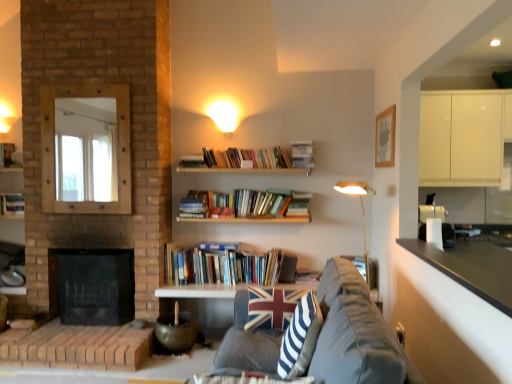
Question: Can you confirm if matte white lampshade at upper center is thinner than union jack fabric pillow at center?

Choices:
 (A) no
 (B) yes

Answer: (B)

Question: Is matte white lampshade at upper center positioned behind union jack fabric pillow at center?

Choices:
 (A) no
 (B) yes

Answer: (B)

Question: From the image's perspective, is matte white lampshade at upper center located above union jack fabric pillow at center?

Choices:
 (A) yes
 (B) no

Answer: (A)

Question: Is matte white lampshade at upper center placed right next to union jack fabric pillow at center?

Choices:
 (A) no
 (B) yes

Answer: (A)

Question: Is union jack fabric pillow at center completely or partially inside matte white lampshade at upper center?

Choices:
 (A) yes
 (B) no

Answer: (B)

Question: Choose the correct answer: Is white glossy cabinet at upper right inside hardcover books at center, which appears as the second book when viewed from the left, or outside it?

Choices:
 (A) outside
 (B) inside

Answer: (A)

Question: In the image, is white glossy cabinet at upper right on the left side or the right side of hardcover books at center, the 2th book when ordered from bottom to top?

Choices:
 (A) left
 (B) right

Answer: (B)

Question: Does point (453, 172) appear closer or farther from the camera than point (260, 274)?

Choices:
 (A) closer
 (B) farther

Answer: (A)

Question: In the image, is white glossy cabinet at upper right positioned in front of or behind hardcover books at center, the 3th book when ordered from top to bottom?

Choices:
 (A) front
 (B) behind

Answer: (A)

Question: From the image's perspective, is blue and white striped fabric pillow at center positioned above or below white glossy cabinet at upper right?

Choices:
 (A) below
 (B) above

Answer: (A)

Question: Looking at their shapes, would you say blue and white striped fabric pillow at center is wider or thinner than white glossy cabinet at upper right?

Choices:
 (A) thin
 (B) wide

Answer: (A)

Question: Considering their positions, is blue and white striped fabric pillow at center located in front of or behind white glossy cabinet at upper right?

Choices:
 (A) behind
 (B) front

Answer: (B)

Question: In terms of height, does blue and white striped fabric pillow at center look taller or shorter compared to white glossy cabinet at upper right?

Choices:
 (A) tall
 (B) short

Answer: (B)

Question: Based on their sizes in the image, would you say wooden picture frame at upper right is bigger or smaller than blue and white striped fabric pillow at center?

Choices:
 (A) small
 (B) big

Answer: (A)

Question: Is point (389, 162) positioned closer to the camera than point (317, 322)?

Choices:
 (A) farther
 (B) closer

Answer: (A)